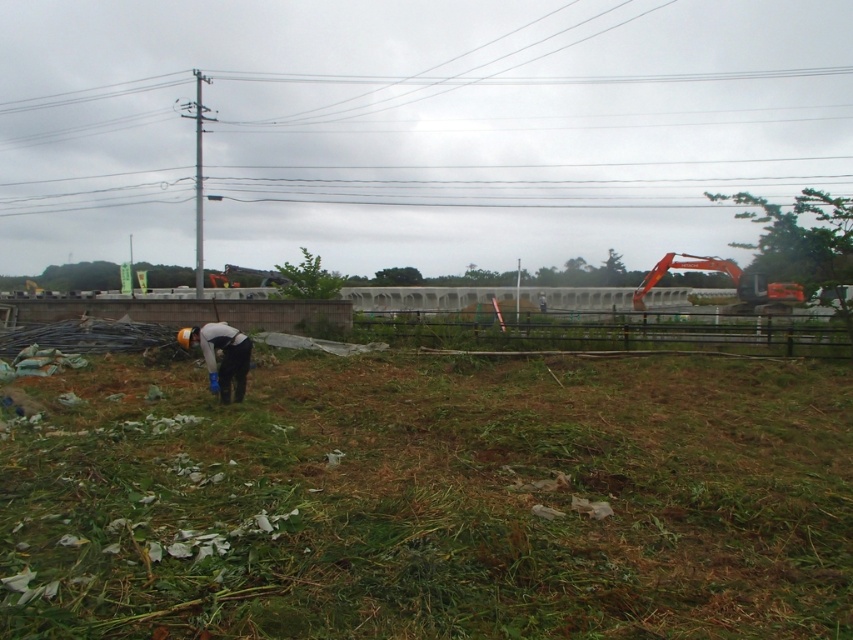
Describe the element at coordinates (431, 500) in the screenshot. I see `green rough grass at lower left` at that location.

The height and width of the screenshot is (640, 853). I want to click on green rough grass at lower left, so click(x=431, y=500).

Is point (117, 440) behind point (190, 339)?

No, it is in front of (190, 339).

At what (x,y) coordinates should I click in order to perform the action: click on green rough grass at lower left. Please return your answer as a coordinate pair (x, y). The image size is (853, 640). Looking at the image, I should click on (431, 500).